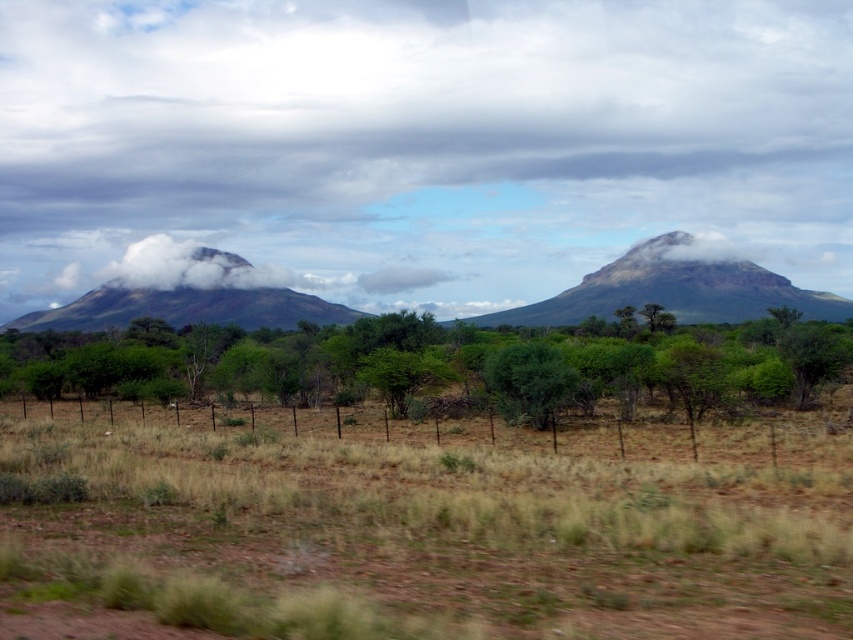
You are standing on the flat expanse of land covered with dry grass and scattered shrubs in the foreground of the image. You want to hike to the rugged brown mountain at center. According to the coordinates provided, is the mountain located closer to the top or the bottom of the image?

The rugged brown mountain at center is located at point coordinates with a y value of 0.790. Since the y value is closer to 1, which typically represents the bottom of the image in coordinate systems, the mountain is positioned closer to the bottom of the image.

You are standing at the base of the mountains and looking towards the horizon. There are two points marked in the scene. The first point is at coordinates point (577, 372) and the second is at point (273, 275). Which point is closer to you?

Point (577, 372) is in front of point (273, 275), so it is closer to you.